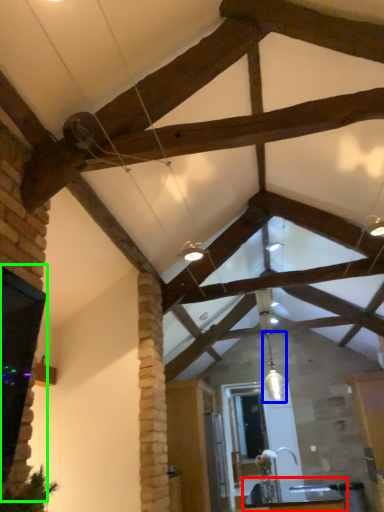
Question: Which is farther away from table (highlighted by a red box)? light fixture (highlighted by a blue box) or window (highlighted by a green box)?

Choices:
 (A) light fixture
 (B) window

Answer: (B)